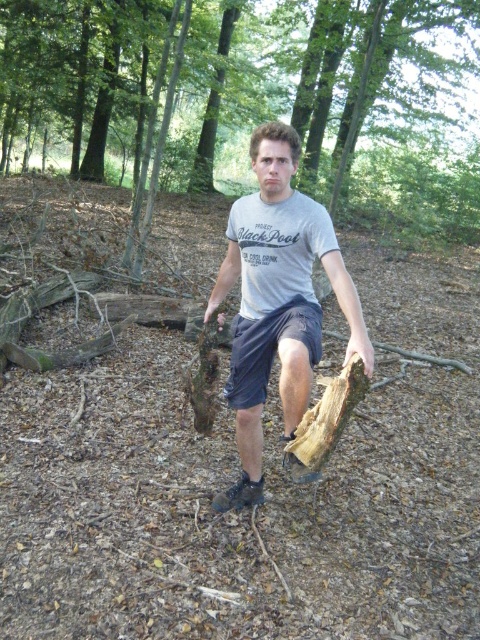
How much distance is there between rough bark tree at center and matte gray t-shirt at center?

rough bark tree at center and matte gray t-shirt at center are 21.41 meters apart.

What do you see at coordinates (253, 97) in the screenshot? I see `rough bark tree at center` at bounding box center [253, 97].

Which is in front, point (330, 122) or point (326, 214)?

Point (326, 214) is more forward.

Find the location of a particular element. The image size is (480, 640). rough bark tree at center is located at coordinates [253, 97].

Is point (240, 380) in front of point (303, 342)?

No.

Who is more forward, (287, 304) or (319, 348)?

Point (319, 348) is more forward.

The width and height of the screenshot is (480, 640). What are the coordinates of `matte gray t-shirt at center` in the screenshot? It's located at pyautogui.click(x=277, y=300).

Is point (295, 92) in front of point (302, 337)?

No, (295, 92) is behind (302, 337).

Is rough bark tree at center bigger than dark blue cotton shorts at center?

Yes, rough bark tree at center is bigger than dark blue cotton shorts at center.

Who is more forward, [468,161] or [251,356]?

Point [251,356] is in front.

Identify the location of rough bark tree at center. The height and width of the screenshot is (640, 480). (253, 97).